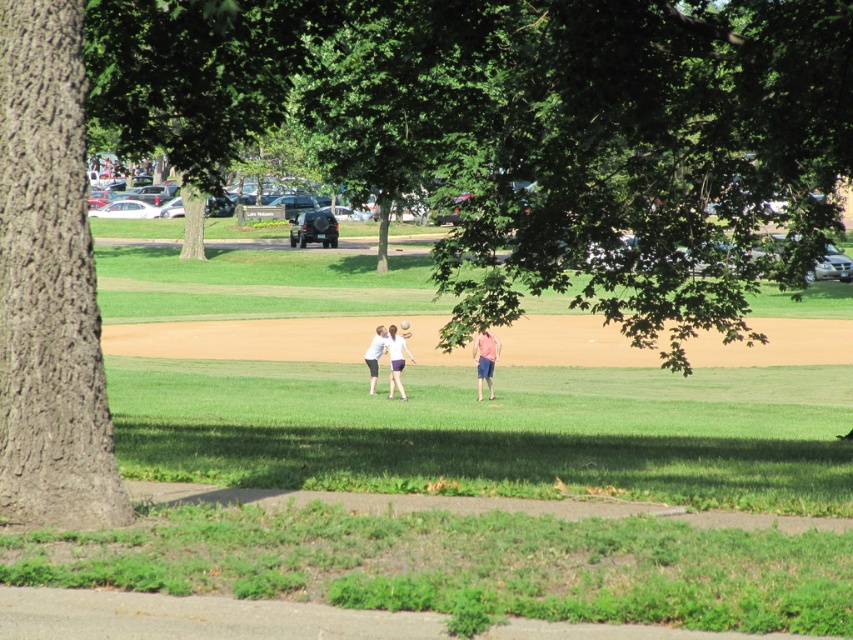
Question: Can you confirm if green leafy tree at upper left is positioned above pink cotton shirt at center?

Choices:
 (A) no
 (B) yes

Answer: (B)

Question: Which is nearer to the green leafy tree at upper left?

Choices:
 (A) smooth brown bark at left
 (B) pink cotton shirt at center

Answer: (A)

Question: Does green leafy tree at upper left have a greater width compared to white cotton shirt at center?

Choices:
 (A) yes
 (B) no

Answer: (A)

Question: Among these objects, which one is farthest from the camera?

Choices:
 (A) white matte shirt at center
 (B) smooth brown bark at left
 (C) green leafy tree at upper left
 (D) pink cotton shirt at center

Answer: (A)

Question: Is white cotton shirt at center bigger than white matte shirt at center?

Choices:
 (A) yes
 (B) no

Answer: (B)

Question: Which object is closer to the camera taking this photo?

Choices:
 (A) white cotton shirt at center
 (B) green leafy tree at upper left
 (C) smooth brown bark at left
 (D) white matte shirt at center

Answer: (C)